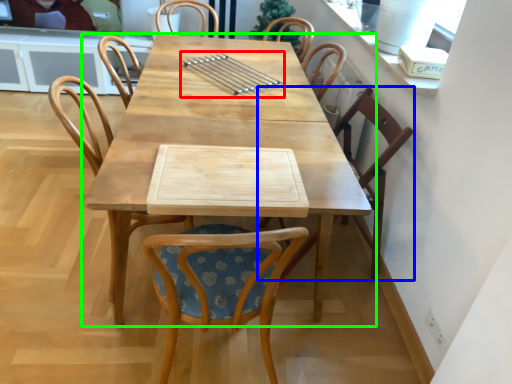
Question: Which is nearer to the tableware (highlighted by a red box)? chair (highlighted by a blue box) or table (highlighted by a green box).

Choices:
 (A) chair
 (B) table

Answer: (B)